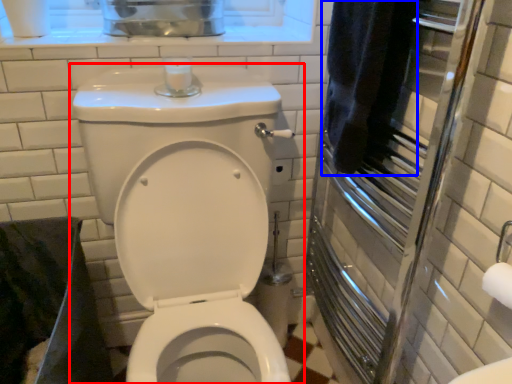
Question: Which point is closer to the camera, toilet (highlighted by a red box) or bath towel (highlighted by a blue box)?

Choices:
 (A) toilet
 (B) bath towel

Answer: (A)